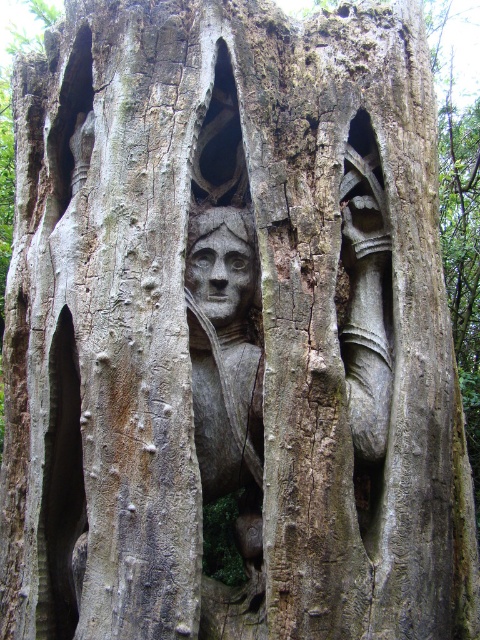
Looking at this image, you are an art student analyzing the sculpture. You notice two carvings at the center of the trunk. Which one is positioned lower between the carved wood face at center and the smooth wood carving at center?

The carved wood face at center is positioned lower than the smooth wood carving at center.

You are an art conservator examining the weathered tree trunk sculpture. You notice two carvings on the trunk. The first is the carved wood face at center, and the second is the smooth wood carving at center. Which of these two carvings is taller?

The carved wood face at center is taller than the smooth wood carving at center.

Looking at this image, you are an artist trying to place a small decorative item between the carved wood face at center and the smooth wood carving at center on the sculpture. Can you fit it there if the item is 10 inches long?

The carved wood face at center and smooth wood carving at center are 10.48 inches apart. Since the decorative item is 10 inches long, it can fit between them as there is enough space.